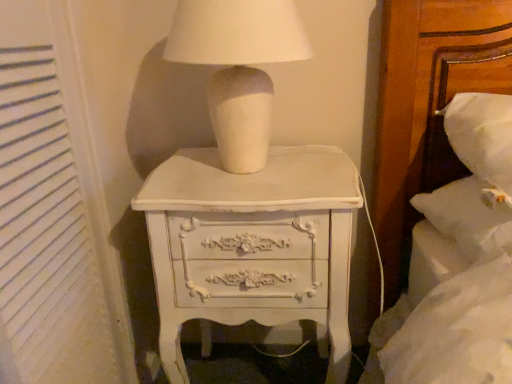
Identify the location of white textured curtain at left. (46, 234).

This screenshot has width=512, height=384. Find the location of `white textured curtain at left`. white textured curtain at left is located at coordinates (46, 234).

Are white matte ceramic lamp at upper center and white textured curtain at left making contact?

No, white matte ceramic lamp at upper center is not making contact with white textured curtain at left.

From the image's perspective, which object appears higher, white matte ceramic lamp at upper center or white textured curtain at left?

white matte ceramic lamp at upper center.

Is white matte ceramic lamp at upper center in front of or behind white textured curtain at left in the image?

Clearly, white matte ceramic lamp at upper center is behind white textured curtain at left.

Identify the location of table lamp that is above the white textured curtain at left (from a real-world perspective). (238, 67).

Looking at this image, is white textured curtain at left with white painted wood chest of drawers at center?

No, white textured curtain at left is not with white painted wood chest of drawers at center.

From their relative heights in the image, would you say white textured curtain at left is taller or shorter than white painted wood chest of drawers at center?

white textured curtain at left is taller than white painted wood chest of drawers at center.

Who is more distant, white textured curtain at left or white painted wood chest of drawers at center?

white painted wood chest of drawers at center is more distant.

Choose the correct answer: Is white painted wood chest of drawers at center inside white textured curtain at left or outside it?

white painted wood chest of drawers at center exists outside the volume of white textured curtain at left.

From a real-world perspective, between white painted wood chest of drawers at center and white textured curtain at left, who is vertically lower?

white painted wood chest of drawers at center.

Does white painted wood chest of drawers at center touch white textured curtain at left?

No, white painted wood chest of drawers at center is not making contact with white textured curtain at left.

Is white painted wood chest of drawers at center aimed at white textured curtain at left?

No, white painted wood chest of drawers at center is not turned towards white textured curtain at left.

Which is in front, point (245, 132) or point (318, 224)?

The point (318, 224) is in front.

Which object is positioned more to the right, white matte ceramic lamp at upper center or white painted wood chest of drawers at center?

white painted wood chest of drawers at center.

Can white painted wood chest of drawers at center be found inside white matte ceramic lamp at upper center?

Definitely not — white painted wood chest of drawers at center is not inside white matte ceramic lamp at upper center.

Is white matte ceramic lamp at upper center looking in the opposite direction of white painted wood chest of drawers at center?

Result: No, white matte ceramic lamp at upper center's orientation is not away from white painted wood chest of drawers at center.

How distant is white textured curtain at left from white matte ceramic lamp at upper center?

white textured curtain at left and white matte ceramic lamp at upper center are 33.03 centimeters apart.

Does white textured curtain at left have a greater height compared to white matte ceramic lamp at upper center?

Yes, white textured curtain at left is taller than white matte ceramic lamp at upper center.

Is white textured curtain at left far away from white matte ceramic lamp at upper center?

No, white textured curtain at left is not far away from white matte ceramic lamp at upper center.

Does white textured curtain at left have a larger size compared to white matte ceramic lamp at upper center?

No.

What's the angular difference between white painted wood chest of drawers at center and white matte ceramic lamp at upper center's facing directions?

The angular difference between white painted wood chest of drawers at center and white matte ceramic lamp at upper center is 5.86 degrees.

Does point (345, 258) appear closer or farther from the camera than point (213, 46)?

Point (345, 258) appears to be farther away from the viewer than point (213, 46).

From the image's perspective, is white painted wood chest of drawers at center on top of white matte ceramic lamp at upper center?

No, from the image's perspective, white painted wood chest of drawers at center is not above white matte ceramic lamp at upper center.

Where is `curtain that appears below the white matte ceramic lamp at upper center (from the image's perspective)`? The image size is (512, 384). curtain that appears below the white matte ceramic lamp at upper center (from the image's perspective) is located at coordinates (46, 234).

Where is `curtain above the white painted wood chest of drawers at center (from a real-world perspective)`? The image size is (512, 384). curtain above the white painted wood chest of drawers at center (from a real-world perspective) is located at coordinates (46, 234).

Looking at the image, which one is located further to white textured curtain at left, white painted wood chest of drawers at center or white matte ceramic lamp at upper center?

white matte ceramic lamp at upper center lies further to white textured curtain at left than the other object.

In the scene shown: From the image, which object appears to be nearer to white painted wood chest of drawers at center, white matte ceramic lamp at upper center or white textured curtain at left?

Among the two, white matte ceramic lamp at upper center is located nearer to white painted wood chest of drawers at center.

Looking at the image, which one is located further to white painted wood chest of drawers at center, white textured curtain at left or white matte ceramic lamp at upper center?

Based on the image, white textured curtain at left appears to be further to white painted wood chest of drawers at center.

Based on their spatial positions, is white painted wood chest of drawers at center or white textured curtain at left closer to white matte ceramic lamp at upper center?

white painted wood chest of drawers at center is positioned closer to the anchor white matte ceramic lamp at upper center.

Which object lies nearer to the anchor point white matte ceramic lamp at upper center, white textured curtain at left or white painted wood chest of drawers at center?

white painted wood chest of drawers at center is closer to white matte ceramic lamp at upper center.

From the image, which object appears to be nearer to white textured curtain at left, white matte ceramic lamp at upper center or white painted wood chest of drawers at center?

The object closer to white textured curtain at left is white painted wood chest of drawers at center.

I want to click on curtain between white matte ceramic lamp at upper center and white painted wood chest of drawers at center in the vertical direction, so pyautogui.click(x=46, y=234).